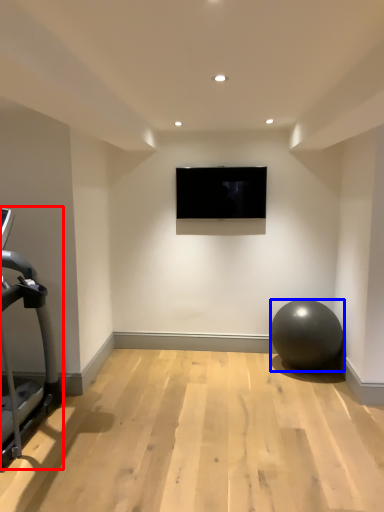
Question: Which of the following is the farthest to the observer, treadmill (highlighted by a red box) or ball (highlighted by a blue box)?

Choices:
 (A) treadmill
 (B) ball

Answer: (B)